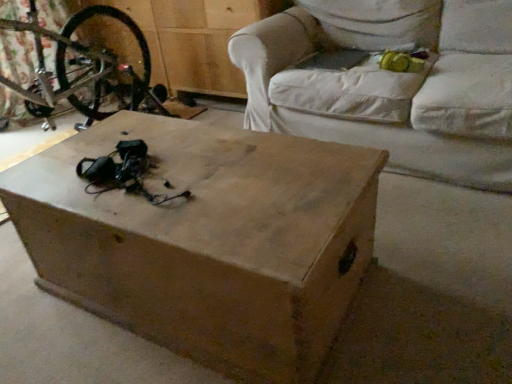
Question: In the image, is white fabric couch at center on the left side or the right side of brown matte wooden box at center?

Choices:
 (A) left
 (B) right

Answer: (B)

Question: Looking at their shapes, would you say white fabric couch at center is wider or thinner than brown matte wooden box at center?

Choices:
 (A) wide
 (B) thin

Answer: (A)

Question: Considering the positions of white fabric couch at center and brown matte wooden box at center in the image, is white fabric couch at center taller or shorter than brown matte wooden box at center?

Choices:
 (A) tall
 (B) short

Answer: (A)

Question: From their relative heights in the image, would you say brown matte wooden box at center is taller or shorter than white fabric couch at center?

Choices:
 (A) tall
 (B) short

Answer: (B)

Question: In the image, is brown matte wooden box at center positioned in front of or behind white fabric couch at center?

Choices:
 (A) behind
 (B) front

Answer: (B)

Question: Would you say brown matte wooden box at center is to the left or to the right of white fabric couch at center in the picture?

Choices:
 (A) left
 (B) right

Answer: (A)

Question: From a real-world perspective, relative to white fabric couch at center, is brown matte wooden box at center vertically above or below?

Choices:
 (A) below
 (B) above

Answer: (A)